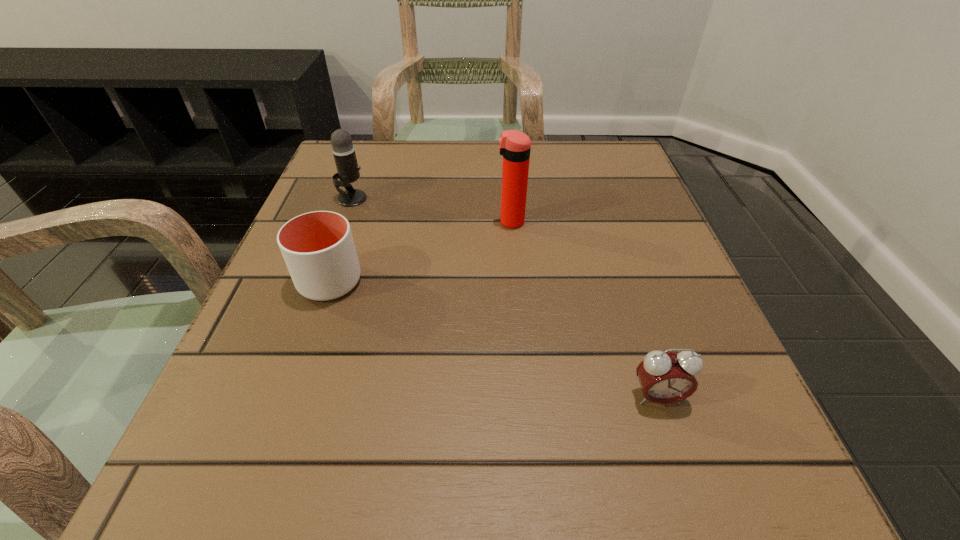
This screenshot has width=960, height=540. In order to click on free space between the alarm clock and the tallest object in this screenshot , I will do `click(584, 309)`.

Identify the location of unoccupied position between the nearest object and the second farthest object. This screenshot has width=960, height=540. (584, 309).

Locate which object ranks third in proximity to the farthest object. Please provide its 2D coordinates. Your answer should be formatted as a tuple, i.e. [(x, y)], where the tuple contains the x and y coordinates of a point satisfying the conditions above.

[(665, 377)]

What are the coordinates of `object that stands as the third closest to the nearest object` in the screenshot? It's located at (343, 150).

Identify the location of vacant space that satisfies the following two spatial constraints: 1. on the front side of the farthest object; 2. on the right side of the second farthest object. The image size is (960, 540). (344, 221).

Identify the location of blank area in the image that satisfies the following two spatial constraints: 1. on the front side of the microphone; 2. on the right side of the third nearest object. Image resolution: width=960 pixels, height=540 pixels. (344, 221).

In order to click on vacant point that satisfies the following two spatial constraints: 1. on the front side of the third shortest object; 2. on the left side of the third farthest object in this screenshot , I will do `click(322, 281)`.

The width and height of the screenshot is (960, 540). In order to click on vacant space that satisfies the following two spatial constraints: 1. on the front side of the second tallest object; 2. on the left side of the thermos bottle in this screenshot , I will do `click(344, 221)`.